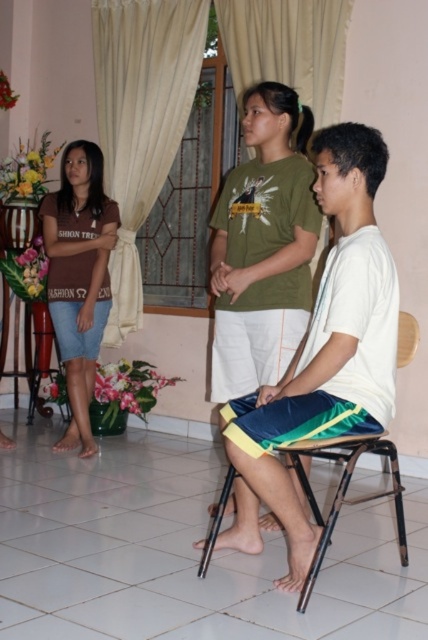
You are standing in the room and want to place a small plant pot between the two points, point (x=359, y=342) and point (x=80, y=166). Which point should the plant pot be closer to if you want it to be nearer to the viewer?

The plant pot should be placed closer to point (x=359, y=342) because it is closer to the viewer than point (x=80, y=166).

You are trying to decide which curtain to use to block out more light in the room. Based on the image, which curtain between the beige fabric curtain at upper left and the white sheer curtain at upper center would be better for blocking light?

The beige fabric curtain at upper left has a greater height compared to white sheer curtain at upper center, so it would be better for blocking more light as it covers a larger area vertically.